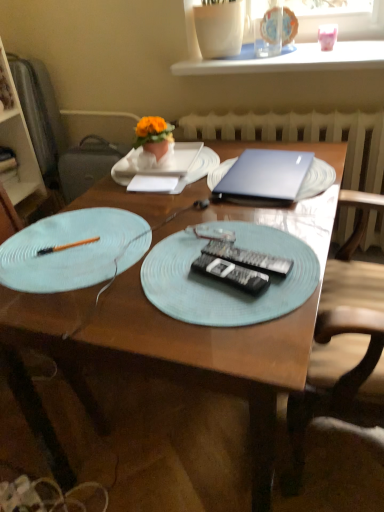
I want to click on vacant area that is situated to the right of black plastic remote control at center, the second remote control in the top-to-bottom sequence, so pyautogui.click(x=297, y=263).